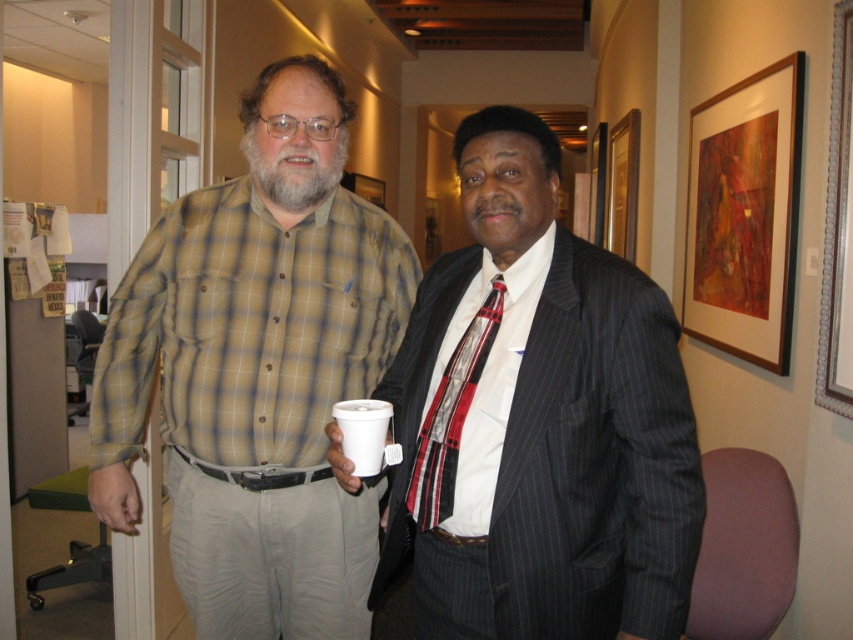
Question: Is plaid shirt at center to the right of brown wooden picture frame at upper right from the viewer's perspective?

Choices:
 (A) yes
 (B) no

Answer: (B)

Question: Which point is closer to the camera?

Choices:
 (A) (628, 116)
 (B) (347, 460)
 (C) (641, 579)

Answer: (C)

Question: Which object is farther from the camera taking this photo?

Choices:
 (A) red plaid tie at center
 (B) striped suit at center
 (C) brown wooden picture frame at upper right
 (D) white styrofoam cup at center

Answer: (C)

Question: Does plaid shirt at center lie in front of brown wooden picture frame at upper right?

Choices:
 (A) no
 (B) yes

Answer: (B)

Question: Does plaid shirt at center have a lesser width compared to brown wooden picture frame at upper right?

Choices:
 (A) no
 (B) yes

Answer: (A)

Question: Which object is the closest to the red plaid tie at center?

Choices:
 (A) plaid shirt at center
 (B) striped suit at center
 (C) white styrofoam cup at center
 (D) brown wooden picture frame at upper right

Answer: (C)